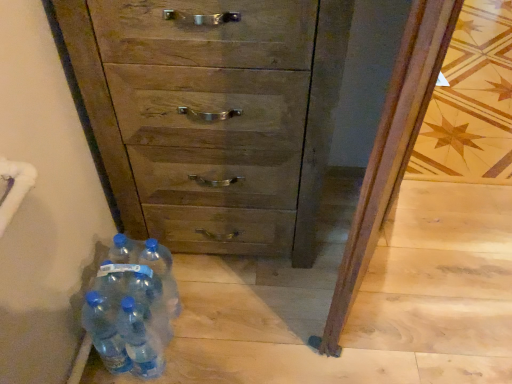
Question: Does translucent plastic water bottles at lower left, the first bottle when ordered from left to right, contain blue translucent bottle at lower left, acting as the 1th bottle starting from the right?

Choices:
 (A) yes
 (B) no

Answer: (B)

Question: Is the surface of translucent plastic water bottles at lower left, the first bottle when ordered from left to right, in direct contact with blue translucent bottle at lower left, acting as the 1th bottle starting from the right?

Choices:
 (A) yes
 (B) no

Answer: (B)

Question: Considering the relative sizes of translucent plastic water bottles at lower left, the first bottle when ordered from left to right, and blue translucent bottle at lower left, acting as the 1th bottle starting from the right, in the image provided, is translucent plastic water bottles at lower left, the first bottle when ordered from left to right, shorter than blue translucent bottle at lower left, acting as the 1th bottle starting from the right,?

Choices:
 (A) no
 (B) yes

Answer: (B)

Question: From the image's perspective, is translucent plastic water bottles at lower left, acting as the fifth bottle starting from the right, below blue translucent bottle at lower left, the fifth bottle positioned from the left?

Choices:
 (A) yes
 (B) no

Answer: (A)

Question: Would you consider translucent plastic water bottles at lower left, the first bottle when ordered from left to right, to be distant from blue translucent bottle at lower left, the fifth bottle positioned from the left?

Choices:
 (A) no
 (B) yes

Answer: (A)

Question: In the image, is wooden chest of drawers at center positioned in front of or behind translucent plastic water bottles at lower left, acting as the fifth bottle starting from the right?

Choices:
 (A) behind
 (B) front

Answer: (B)

Question: From the image's perspective, relative to translucent plastic water bottles at lower left, acting as the fifth bottle starting from the right, is wooden chest of drawers at center above or below?

Choices:
 (A) below
 (B) above

Answer: (B)

Question: Do you think wooden chest of drawers at center is within translucent plastic water bottles at lower left, the first bottle when ordered from left to right, or outside of it?

Choices:
 (A) inside
 (B) outside

Answer: (B)

Question: Considering the positions of point (334, 8) and point (102, 347), is point (334, 8) closer or farther from the camera than point (102, 347)?

Choices:
 (A) closer
 (B) farther

Answer: (A)

Question: Choose the correct answer: Is transparent plastic bottles at lower left, the fourth bottle viewed from the left, inside blue translucent bottle at lower left, the fifth bottle positioned from the left, or outside it?

Choices:
 (A) inside
 (B) outside

Answer: (B)

Question: Considering the positions of transparent plastic bottles at lower left, the second bottle viewed from the right, and blue translucent bottle at lower left, acting as the 1th bottle starting from the right, in the image, is transparent plastic bottles at lower left, the second bottle viewed from the right, taller or shorter than blue translucent bottle at lower left, acting as the 1th bottle starting from the right,?

Choices:
 (A) short
 (B) tall

Answer: (B)

Question: From a real-world perspective, is transparent plastic bottles at lower left, the fourth bottle viewed from the left, physically located above or below blue translucent bottle at lower left, acting as the 1th bottle starting from the right?

Choices:
 (A) below
 (B) above

Answer: (B)

Question: Looking at their shapes, would you say transparent plastic bottles at lower left, the fourth bottle viewed from the left, is wider or thinner than blue translucent bottle at lower left, acting as the 1th bottle starting from the right?

Choices:
 (A) thin
 (B) wide

Answer: (A)

Question: Is point (155, 249) closer or farther from the camera than point (155, 329)?

Choices:
 (A) farther
 (B) closer

Answer: (A)

Question: Considering the relative positions of blue translucent bottle at lower left, acting as the 1th bottle starting from the right, and transparent plastic bottles at lower left, the second bottle viewed from the right, in the image provided, is blue translucent bottle at lower left, acting as the 1th bottle starting from the right, to the left or to the right of transparent plastic bottles at lower left, the second bottle viewed from the right,?

Choices:
 (A) right
 (B) left

Answer: (A)